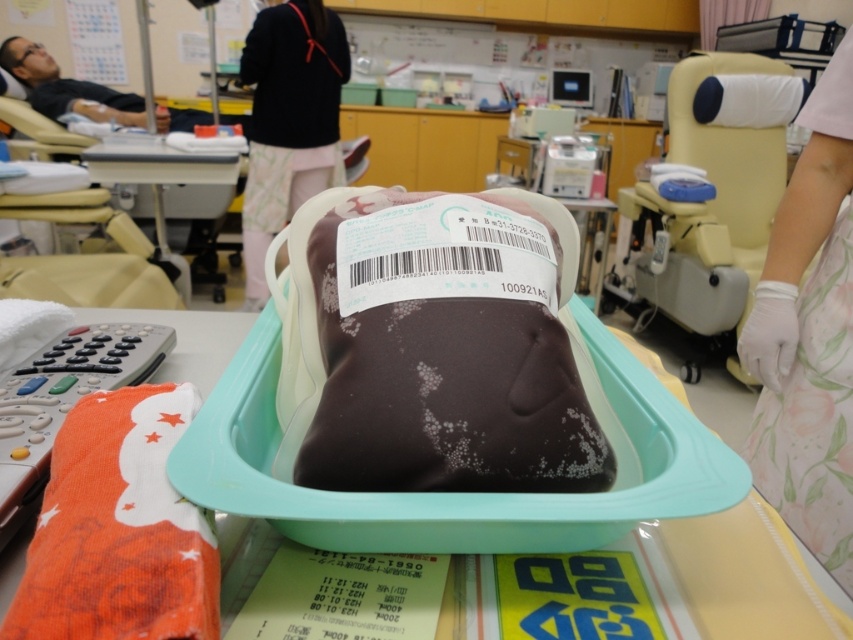
Question: Is black fabric at upper center wider than orange fabric remote control at lower left?

Choices:
 (A) yes
 (B) no

Answer: (A)

Question: Among these objects, which one is nearest to the camera?

Choices:
 (A) beige plastic chair at upper right
 (B) orange fabric remote control at lower left
 (C) dark brown plastic bag at center

Answer: (C)

Question: Among these objects, which one is farthest from the camera?

Choices:
 (A) black fabric at upper center
 (B) matte black person at upper left

Answer: (B)

Question: Considering the relative positions of black fabric at upper center and matte black person at upper left in the image provided, where is black fabric at upper center located with respect to matte black person at upper left?

Choices:
 (A) right
 (B) left

Answer: (A)

Question: Considering the relative positions of black fabric at upper center and orange fabric remote control at lower left in the image provided, where is black fabric at upper center located with respect to orange fabric remote control at lower left?

Choices:
 (A) above
 (B) below

Answer: (A)

Question: Which point is closer to the camera taking this photo?

Choices:
 (A) (695, 120)
 (B) (474, 412)
 (C) (28, 90)

Answer: (B)